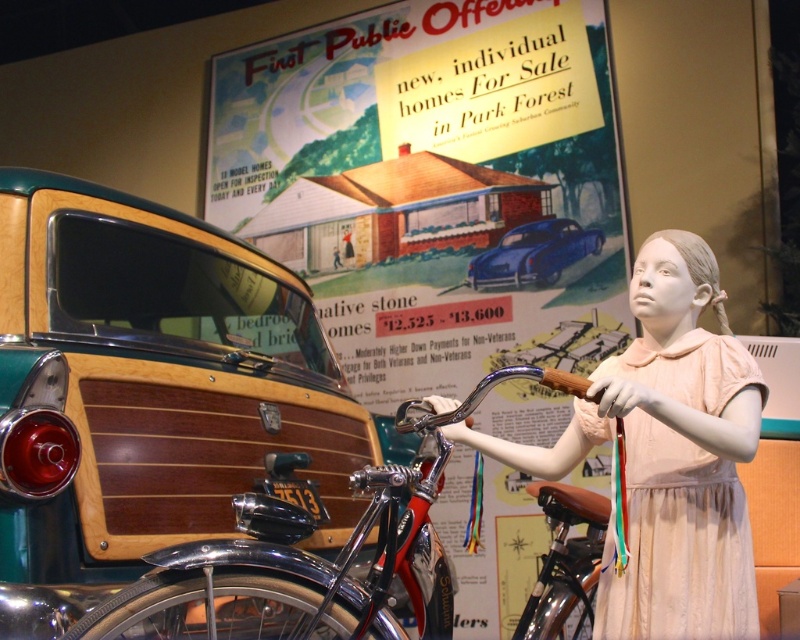
Question: Does wooden signboard at center appear on the right side of wooden paneling at left?

Choices:
 (A) yes
 (B) no

Answer: (A)

Question: Which object is the closest to the wooden signboard at center?

Choices:
 (A) wooden paneling at left
 (B) shiny blue car at center
 (C) porcelain doll at center

Answer: (B)

Question: Which of the following is the closest to the observer?

Choices:
 (A) (634, 528)
 (B) (376, 234)
 (C) (112, 634)
 (D) (512, 230)

Answer: (C)

Question: Which point is farther from the camera taking this photo?

Choices:
 (A) (381, 529)
 (B) (148, 429)

Answer: (B)

Question: Can you confirm if wooden signboard at center is wider than shiny chrome bicycle at center?

Choices:
 (A) no
 (B) yes

Answer: (B)

Question: Does wooden signboard at center appear under shiny blue car at center?

Choices:
 (A) yes
 (B) no

Answer: (B)